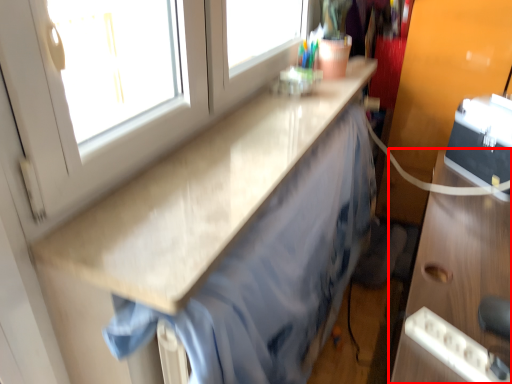
Question: In this image, where is cabinetry (annotated by the red box) located relative to countertop?

Choices:
 (A) right
 (B) left

Answer: (A)